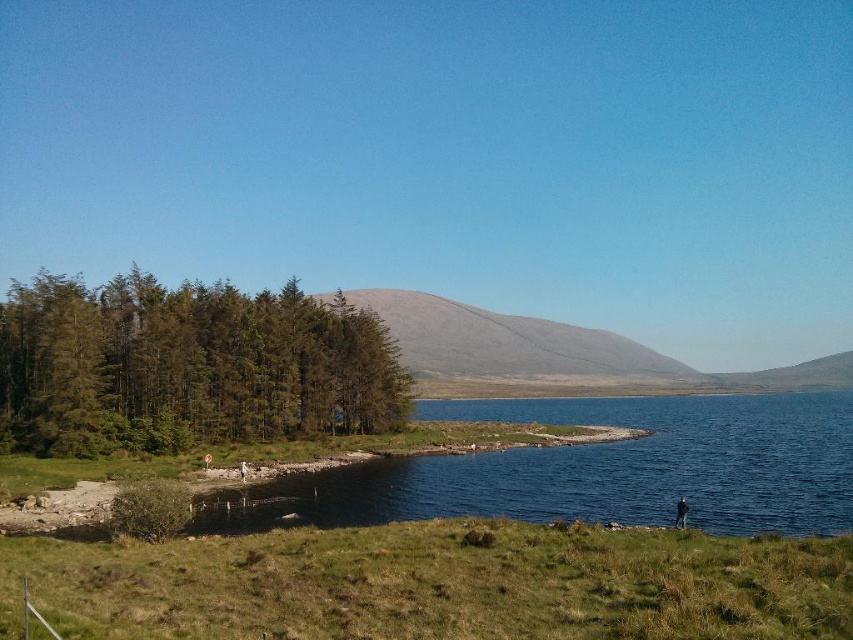
You are standing at the edge of the scene and want to walk towards the gray matte hillside at center. Which direction should you move relative to the green grassy at lower center?

Since the green grassy at lower center is to the left of the gray matte hillside at center, you should move to the right of the green grassy at lower center to reach the gray matte hillside at center.

You are standing at the center of the grassy area in the scene. Which direction should you walk to reach the green textured trees at left?

You should walk to the left to reach the green textured trees at left since they are located at the left side of the image.

You are a hiker planning to cross the terrain from the green grassy at lower center to the gray matte hillside at center. Based on their heights, which area would you expect to be easier to traverse?

The green grassy at lower center is shorter than the gray matte hillside at center, so it would be easier to traverse the green grassy at lower center since it has a lower elevation.